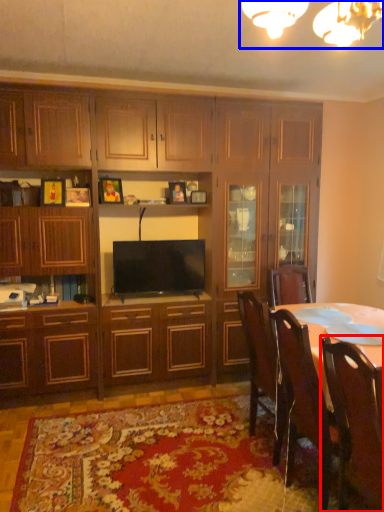
Question: Which of the following is the farthest to the observer, chair (highlighted by a red box) or light fixture (highlighted by a blue box)?

Choices:
 (A) chair
 (B) light fixture

Answer: (A)